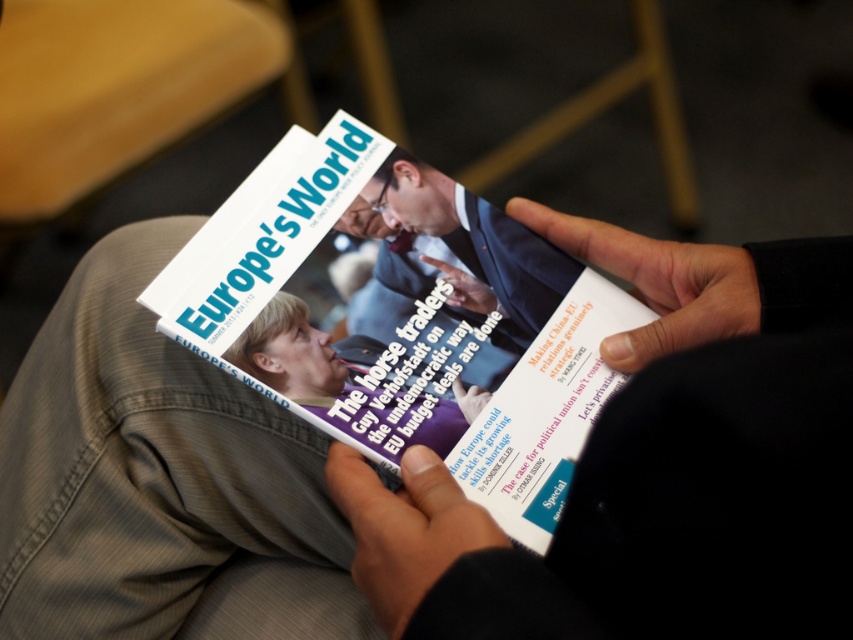
Question: Which of these objects is positioned farthest from the white glossy magazine at center?

Choices:
 (A) matte black hand at center
 (B) smooth skin hand at lower center
 (C) smooth black hand at center
 (D) matte black hand at upper center

Answer: (B)

Question: Is white glossy magazine at center positioned at the back of black leather hand at center?

Choices:
 (A) no
 (B) yes

Answer: (A)

Question: Can you confirm if smooth black hand at center is wider than black leather hand at center?

Choices:
 (A) no
 (B) yes

Answer: (B)

Question: Does smooth skin hand at lower center come behind matte black hand at upper center?

Choices:
 (A) yes
 (B) no

Answer: (B)

Question: Among these objects, which one is farthest from the camera?

Choices:
 (A) black leather hand at center
 (B) matte black hand at center
 (C) smooth black hand at center
 (D) white glossy magazine at center

Answer: (A)

Question: Which of the following is the closest to the observer?

Choices:
 (A) matte black hand at center
 (B) matte black hand at upper center
 (C) smooth black hand at center
 (D) black leather hand at center

Answer: (C)